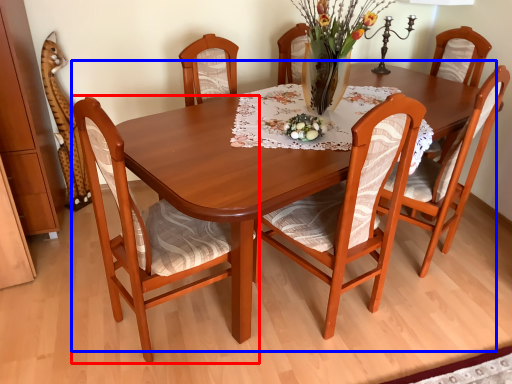
Question: Which object is further to the camera taking this photo, chair (highlighted by a red box) or kitchen & dining room table (highlighted by a blue box)?

Choices:
 (A) chair
 (B) kitchen & dining room table

Answer: (A)